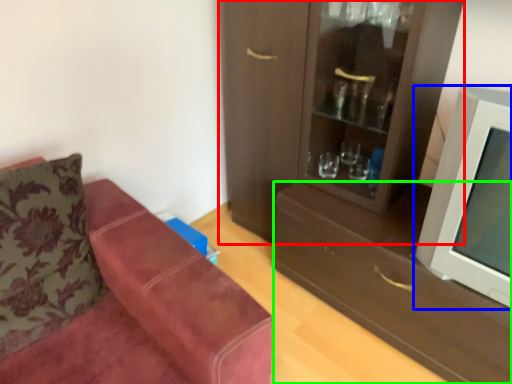
Question: Which object is positioned farthest from cabinetry (highlighted by a red box)? Select from television (highlighted by a blue box) and drawer (highlighted by a green box).

Choices:
 (A) television
 (B) drawer

Answer: (A)